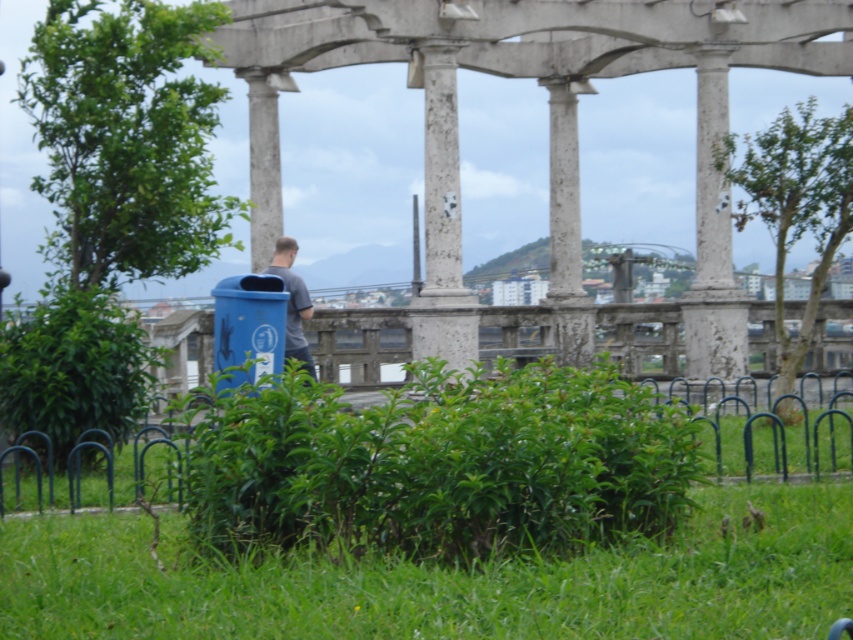
Question: Observing the image, what is the correct spatial positioning of white stone column at center in reference to gray matte shirt at center?

Choices:
 (A) above
 (B) below

Answer: (B)

Question: Observing the image, what is the correct spatial positioning of green leafy grass at lower center in reference to white stone column at center?

Choices:
 (A) left
 (B) right

Answer: (B)

Question: Is white stone column at center thinner than gray matte shirt at center?

Choices:
 (A) yes
 (B) no

Answer: (A)

Question: Considering the real-world distances, which object is closest to the gray matte shirt at center?

Choices:
 (A) green leafy grass at lower center
 (B) white stone column at center

Answer: (B)

Question: Which point is farther from the camera taking this photo?

Choices:
 (A) (682, 592)
 (B) (444, 257)

Answer: (B)

Question: Which object is farther from the camera taking this photo?

Choices:
 (A) green leafy grass at lower center
 (B) white stone column at center
 (C) gray matte shirt at center

Answer: (B)